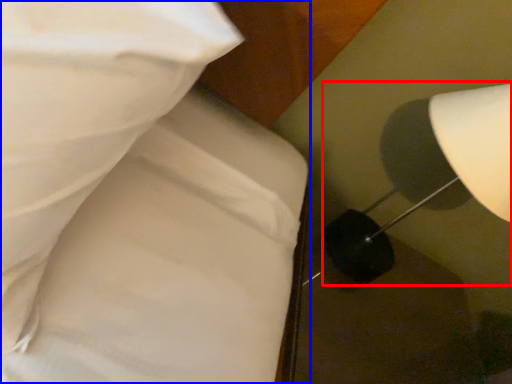
Question: Which point is closer to the camera, lamp (highlighted by a red box) or bed (highlighted by a blue box)?

Choices:
 (A) lamp
 (B) bed

Answer: (B)